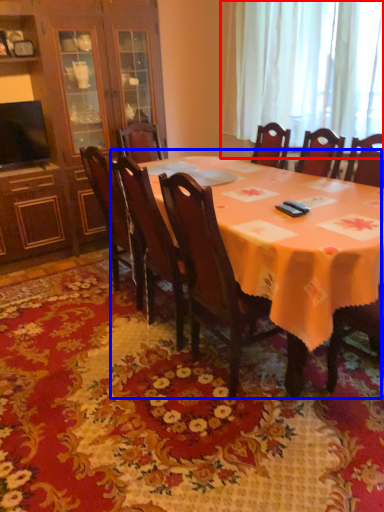
Question: Which object appears closest to the camera in this image, curtain (highlighted by a red box) or kitchen & dining room table (highlighted by a blue box)?

Choices:
 (A) curtain
 (B) kitchen & dining room table

Answer: (B)